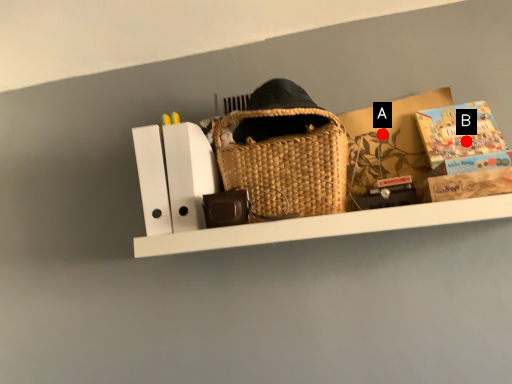
Question: Two points are circled on the image, labeled by A and B beside each circle. Which of the following is the farthest from the observer?

Choices:
 (A) A is further
 (B) B is further

Answer: (A)